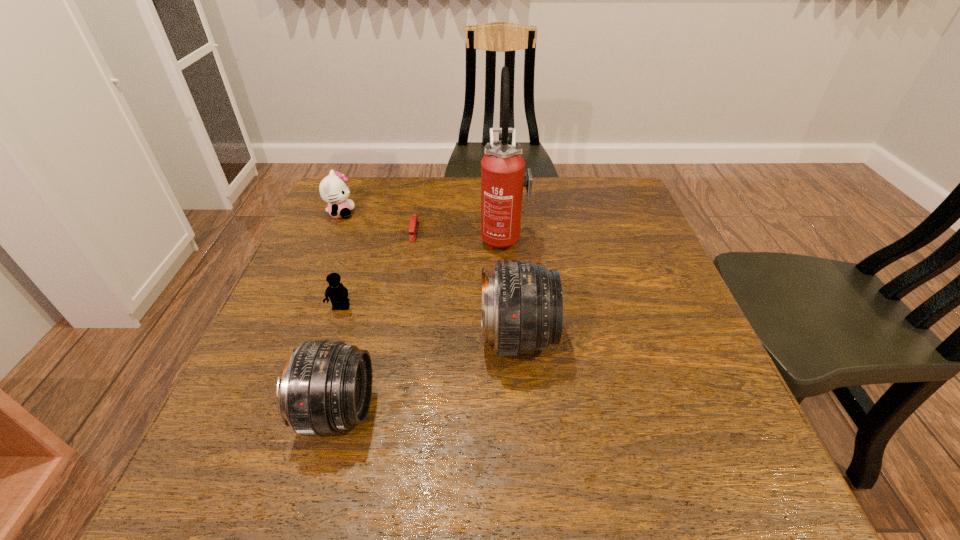
You are a GUI agent. You are given a task and a screenshot of the screen. Output one action in this format:
    pyautogui.click(x=<x>, y=<y>)
    Task: Click on the vacant region located 0.300m at the front element of the shorter telephoto lens
    The width and height of the screenshot is (960, 540).
    Given the screenshot: What is the action you would take?
    pyautogui.click(x=544, y=411)

The image size is (960, 540). Identify the location of vacant space located 0.310m at the front element of the second tallest object. (706, 338).

In order to click on free region located 0.320m at the nozzle of the tallest object in this screenshot , I will do `click(356, 237)`.

Find the location of `free space located at the nozzle of the tallest object`. free space located at the nozzle of the tallest object is located at coordinates (375, 237).

Find the location of a particular element. The image size is (960, 540). vacant space located at the nozzle of the tallest object is located at coordinates (449, 237).

You are a GUI agent. You are given a task and a screenshot of the screen. Output one action in this format:
    pyautogui.click(x=<x>, y=<y>)
    Task: Click on the vacant region located 0.260m on the front-facing side of the fourth tallest object
    
    Given the screenshot: What is the action you would take?
    pyautogui.click(x=449, y=213)

Identify the location of vacant space located 0.140m on the front-facing side of the stapler. 405,279.

You are a GUI agent. You are given a task and a screenshot of the screen. Output one action in this format:
    pyautogui.click(x=<x>, y=<y>)
    Task: Click on the free location located 0.200m on the front-facing side of the Lego
    The image size is (960, 540).
    Given the screenshot: What is the action you would take?
    pyautogui.click(x=312, y=396)

The image size is (960, 540). I want to click on fire extinguisher present at the far edge, so click(503, 177).

The width and height of the screenshot is (960, 540). Identify the location of kitten present at the far edge. (333, 189).